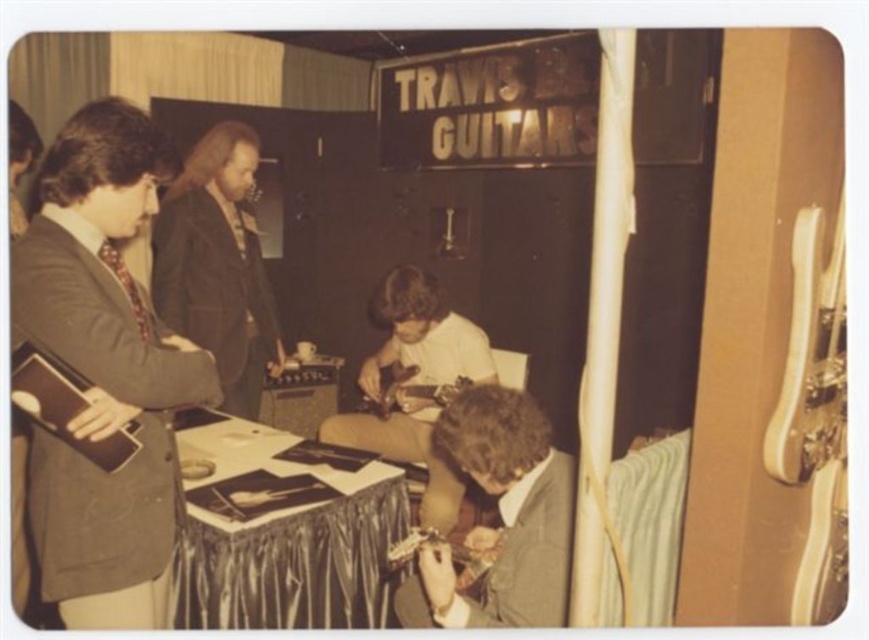
Question: Is matte black guitar at left to the right of smooth brown hair at center from the viewer's perspective?

Choices:
 (A) no
 (B) yes

Answer: (B)

Question: Which of the following is the farthest from the observer?

Choices:
 (A) metallic silver table at center
 (B) smooth brown hair at center
 (C) dark brown leather jacket at lower center

Answer: (B)

Question: Can you confirm if matte black guitar at left is bigger than wooden acoustic guitar at center?

Choices:
 (A) yes
 (B) no

Answer: (A)

Question: Which object is positioned farthest from the dark brown leather jacket at lower center?

Choices:
 (A) metallic silver table at center
 (B) wooden acoustic guitar at center
 (C) matte brown guitar at center
 (D) matte black guitar at left

Answer: (B)

Question: Can you confirm if smooth brown hair at center is bigger than wooden acoustic guitar at center?

Choices:
 (A) yes
 (B) no

Answer: (A)

Question: Among these objects, which one is farthest from the camera?

Choices:
 (A) dark brown leather jacket at lower center
 (B) smooth brown hair at center
 (C) metallic silver table at center

Answer: (B)